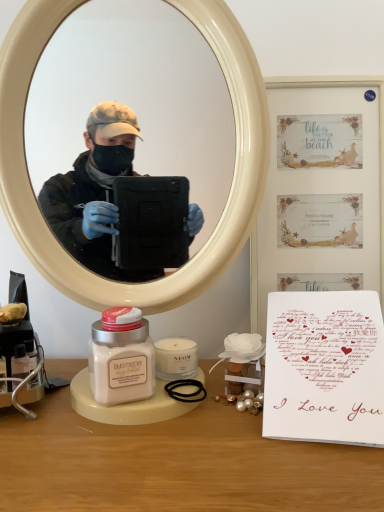
In order to face matte white jar at center, should I rotate leftwards or rightwards?

Turn right approximately 6.779 degrees to face it.

What do you see at coordinates (177, 463) in the screenshot? I see `matte white jar at center` at bounding box center [177, 463].

Locate an element on the screen. matte white jar at center is located at coordinates (177, 463).

Find the location of a particular element. The height and width of the screenshot is (512, 384). matte white jar at center is located at coordinates (177, 463).